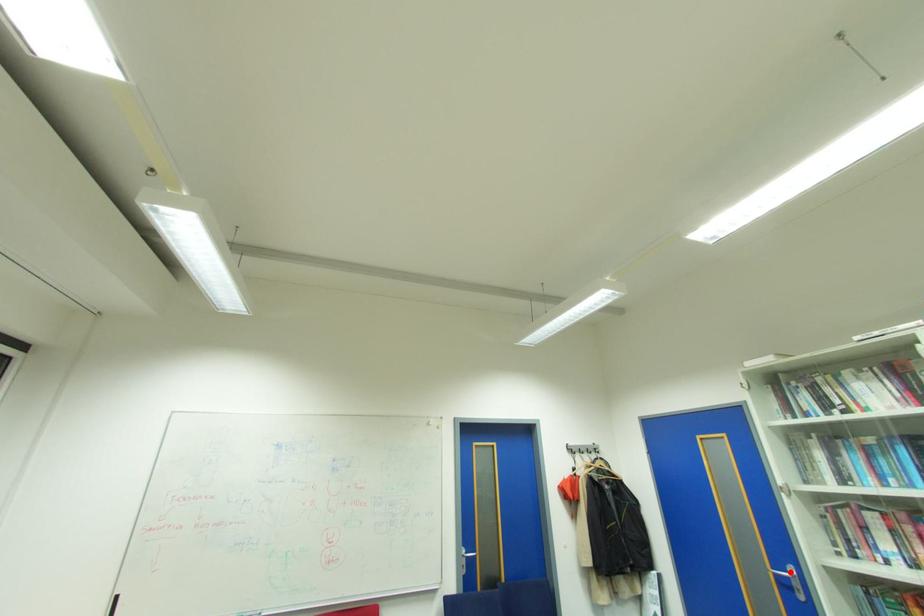
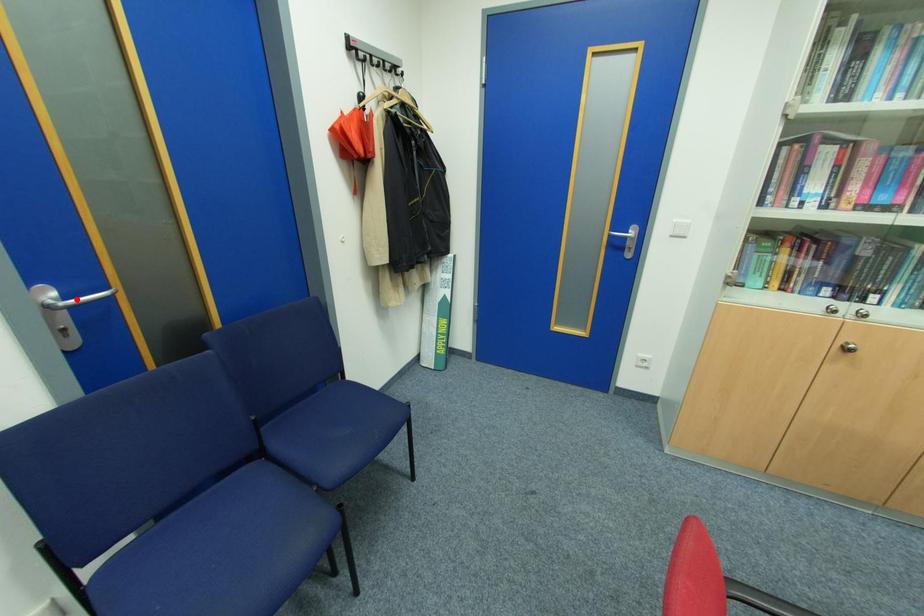
I am providing you with two images of the same scene from different viewpoints. A red point is marked on the first image and another point is marked on the second image. Does the point marked in image1 correspond to the same location as the one in image2?

No